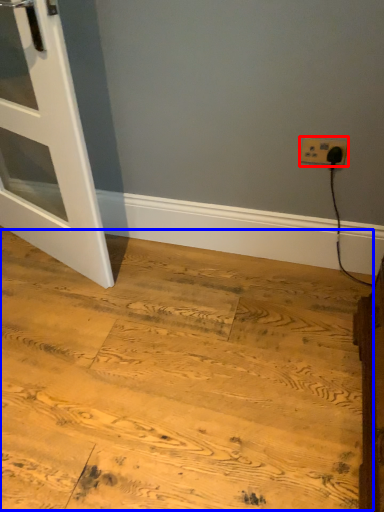
Question: Among these objects, which one is nearest to the camera, power plugs and sockets (highlighted by a red box) or plywood (highlighted by a blue box)?

Choices:
 (A) power plugs and sockets
 (B) plywood

Answer: (B)